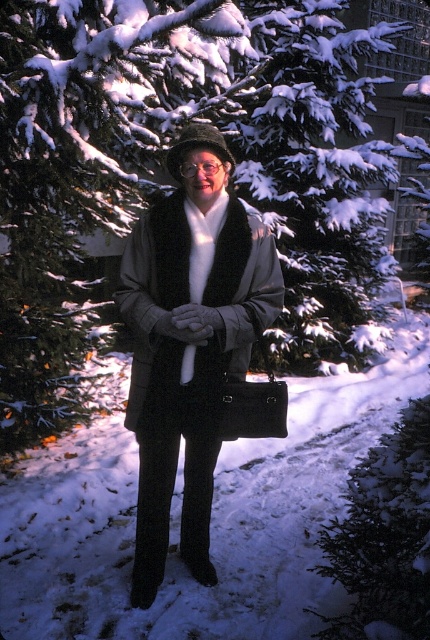
You are a photographer trying to adjust the lighting for a portrait. The subject is wearing a matte black coat at center and transparent plastic goggles at center. Which object should you focus on to ensure proper exposure, considering one is closer to the camera?

The matte black coat at center is in front of the transparent plastic goggles at center, so you should focus on the matte black coat at center for proper exposure since it is closer to the camera.